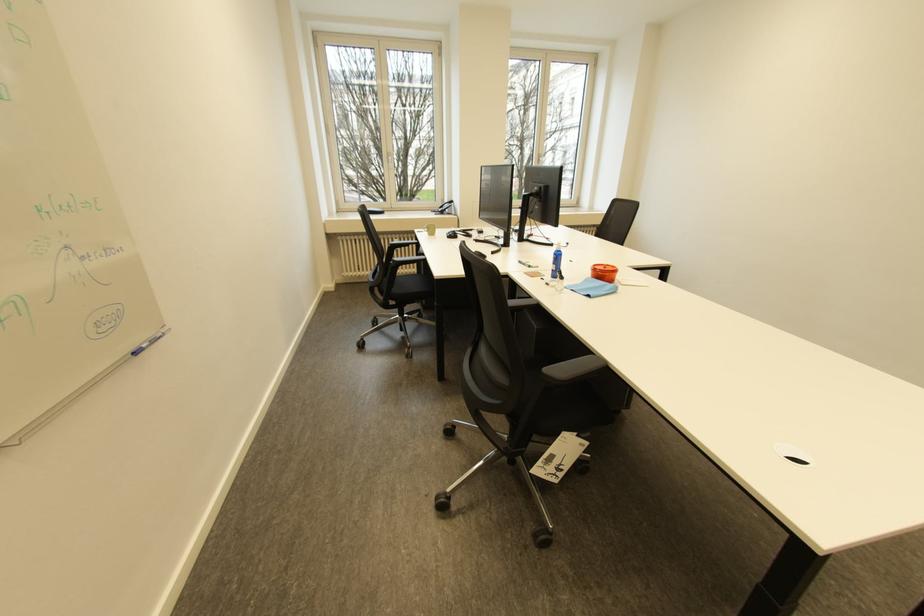
Where would you lift the pair of glasses? Please return your answer as a coordinate pair (x, y).

(491, 240)